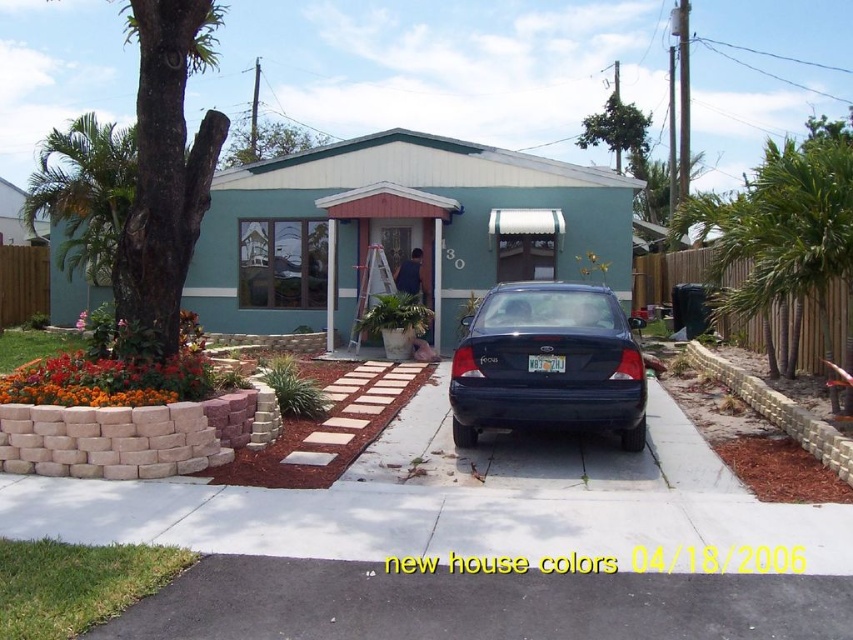
Question: Is black asphalt driveway at lower center to the right of glossy dark blue sedan at center from the viewer's perspective?

Choices:
 (A) no
 (B) yes

Answer: (A)

Question: Which of the following is the closest to the observer?

Choices:
 (A) coord(396,627)
 (B) coord(607,314)

Answer: (A)

Question: Which point is farther to the camera?

Choices:
 (A) (534, 320)
 (B) (384, 605)

Answer: (A)

Question: Is black asphalt driveway at lower center thinner than glossy dark blue sedan at center?

Choices:
 (A) yes
 (B) no

Answer: (B)

Question: Can you confirm if black asphalt driveway at lower center is bigger than glossy dark blue sedan at center?

Choices:
 (A) no
 (B) yes

Answer: (A)